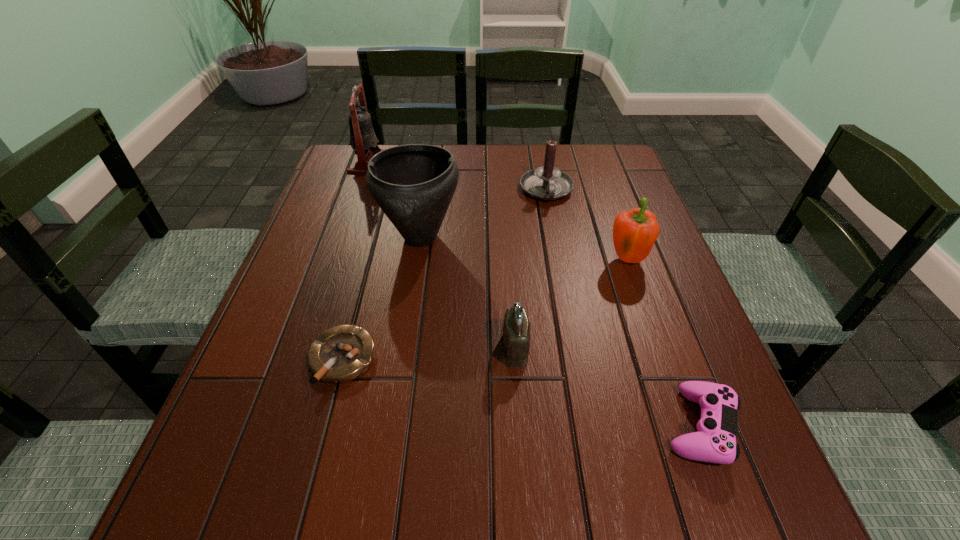
The height and width of the screenshot is (540, 960). In order to click on vacant space positioned on the front of the pepper in this screenshot , I will do `click(653, 338)`.

Image resolution: width=960 pixels, height=540 pixels. I want to click on vacant space situated 0.060m on the side of the candle with the handle loop, so click(552, 222).

The height and width of the screenshot is (540, 960). Find the location of `vacant area situated 0.050m at the front of the padlock near the keyhole`. vacant area situated 0.050m at the front of the padlock near the keyhole is located at coordinates (475, 348).

The image size is (960, 540). I want to click on vacant space located at the front of the padlock near the keyhole, so click(x=422, y=348).

This screenshot has width=960, height=540. What are the coordinates of `free space located at the front of the padlock near the keyhole` in the screenshot? It's located at (333, 348).

Identify the location of vacant space located 0.090m on the back of the control. (670, 346).

Where is `vacant space located 0.230m on the front of the ashtray`? The height and width of the screenshot is (540, 960). vacant space located 0.230m on the front of the ashtray is located at coordinates (297, 535).

This screenshot has height=540, width=960. Identify the location of bell that is positioned at the far edge. (363, 140).

The height and width of the screenshot is (540, 960). What are the coordinates of `candle situated at the far edge` in the screenshot? It's located at (547, 182).

Find the location of a particular element. bell present at the left edge is located at coordinates (363, 140).